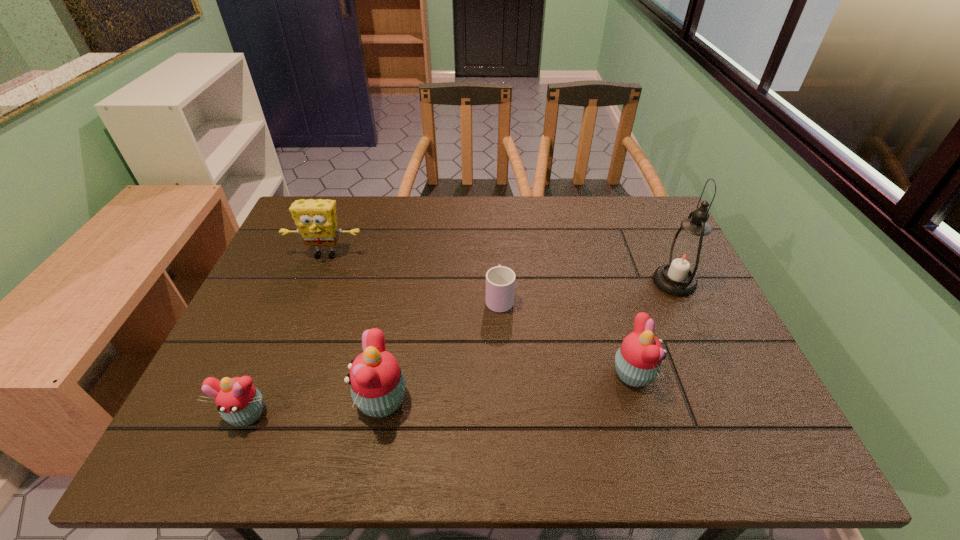
Image resolution: width=960 pixels, height=540 pixels. Identify the location of sponge that is at the left edge. (316, 221).

The height and width of the screenshot is (540, 960). In order to click on object that is at the right edge in this screenshot , I will do `click(684, 257)`.

Image resolution: width=960 pixels, height=540 pixels. I want to click on object positioned at the near left corner, so click(x=238, y=401).

At what (x,y) coordinates should I click in order to perform the action: click on free location at the far edge of the desktop. Please return your answer as a coordinate pair (x, y). Looking at the image, I should click on (403, 217).

Identify the location of vacant space at the near edge of the desktop. The image size is (960, 540). (620, 389).

Where is `vacant area at the left edge`? vacant area at the left edge is located at coordinates (235, 369).

Image resolution: width=960 pixels, height=540 pixels. I want to click on vacant region at the right edge of the desktop, so click(645, 266).

What are the coordinates of `blank area at the near left corner` in the screenshot? It's located at (197, 404).

The image size is (960, 540). In order to click on free spot at the far right corner of the desktop in this screenshot , I will do `click(614, 207)`.

Find the location of `free spot between the shortest object and the tallest object`. free spot between the shortest object and the tallest object is located at coordinates (587, 290).